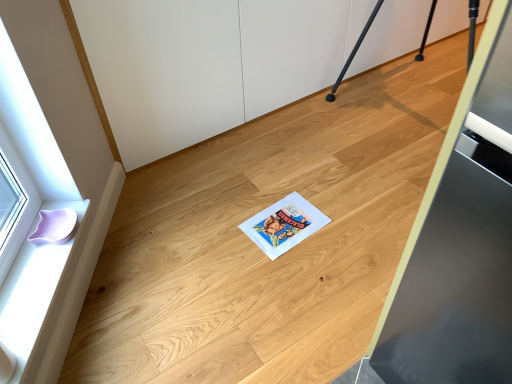
I want to click on vacant area on top of white paper comic book at center (from a real-world perspective), so coord(282,225).